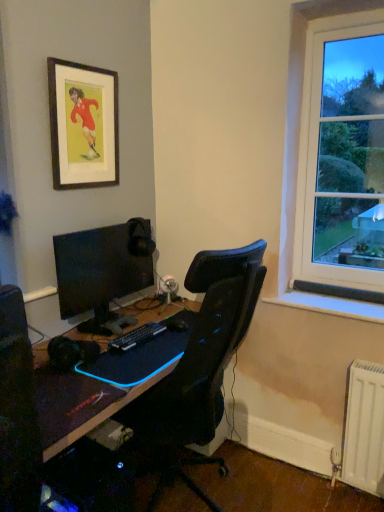
Locate an element on the screen. black plastic keyboard at center is located at coordinates (137, 336).

This screenshot has width=384, height=512. Describe the element at coordinates (168, 287) in the screenshot. I see `metallic silver speaker at center` at that location.

Describe the element at coordinates (79, 404) in the screenshot. I see `black matte desk at center` at that location.

Where is `black plastic keyboard at center`? The image size is (384, 512). black plastic keyboard at center is located at coordinates (137, 336).

Is wooden framed print at upper left bigger than black plastic keyboard at center?

Indeed, wooden framed print at upper left has a larger size compared to black plastic keyboard at center.

Is wooden framed print at upper left looking in the opposite direction of black plastic keyboard at center?

No, black plastic keyboard at center is not at the back of wooden framed print at upper left.

Measure the distance between wooden framed print at upper left and black plastic keyboard at center.

wooden framed print at upper left and black plastic keyboard at center are 36.84 inches apart from each other.

Looking at this image, is wooden framed print at upper left positioned far away from black plastic keyboard at center?

That's not correct — wooden framed print at upper left is a little close to black plastic keyboard at center.

Looking at this image, looking at their sizes, would you say black matte desk at center is wider or thinner than black glossy monitor at left?

Clearly, black matte desk at center has more width compared to black glossy monitor at left.

Which of these two, black matte desk at center or black glossy monitor at left, stands taller?

Standing taller between the two is black glossy monitor at left.

Is black matte desk at center bigger than black glossy monitor at left?

Yes.

Between black matte desk at center and black glossy monitor at left, which one is positioned behind?

Positioned behind is black glossy monitor at left.

How many degrees apart are the facing directions of metallic silver speaker at center and black glossy monitor at left?

They differ by 0.00374 degrees in their facing directions.

In the scene shown: From the image's perspective, would you say metallic silver speaker at center is shown under black glossy monitor at left?

Indeed, from the image's perspective, metallic silver speaker at center is shown beneath black glossy monitor at left.

Is black glossy monitor at left completely or partially inside metallic silver speaker at center?

No, metallic silver speaker at center does not contain black glossy monitor at left.

Which object is positioned more to the right, metallic silver speaker at center or black glossy monitor at left?

metallic silver speaker at center.

You are a GUI agent. You are given a task and a screenshot of the screen. Output one action in this format:
    pyautogui.click(x=<x>, y=<y>)
    Task: Click on the computer keyboard lying on the right of black matte desk at center
    The height and width of the screenshot is (512, 384).
    Given the screenshot: What is the action you would take?
    pyautogui.click(x=137, y=336)

Is black matte desk at center oriented away from black plastic keyboard at center?

No, black matte desk at center is not facing away from black plastic keyboard at center.

From a real-world perspective, is black matte desk at center located beneath black plastic keyboard at center?

Yes, from a real-world perspective, black matte desk at center is below black plastic keyboard at center.

Is black plastic keyboard at center at the left side of wooden framed print at upper left?

In fact, black plastic keyboard at center is to the right of wooden framed print at upper left.

Is black plastic keyboard at center facing towards wooden framed print at upper left?

No.

Is black plastic keyboard at center smaller than metallic silver speaker at center?

Correct, black plastic keyboard at center occupies less space than metallic silver speaker at center.

Consider the image. Can you tell me how much black plastic keyboard at center and metallic silver speaker at center differ in facing direction?

The facing directions of black plastic keyboard at center and metallic silver speaker at center are 0.000776 degrees apart.

Is point (158, 332) closer to camera compared to point (173, 286)?

Yes.

Looking at this image, is black plastic keyboard at center far from black glossy monitor at left?

No, black plastic keyboard at center is not far away from black glossy monitor at left.

Locate an element on the screen. The image size is (384, 512). computer monitor that is above the black plastic keyboard at center (from a real-world perspective) is located at coordinates (102, 270).

Which of these two, black plastic keyboard at center or black glossy monitor at left, is thinner?

Thinner between the two is black plastic keyboard at center.

From the image's perspective, is black plastic keyboard at center located above black glossy monitor at left?

Actually, black plastic keyboard at center appears below black glossy monitor at left in the image.

This screenshot has height=512, width=384. Find the location of `computer keyboard located underneath the wooden framed print at upper left (from a real-world perspective)`. computer keyboard located underneath the wooden framed print at upper left (from a real-world perspective) is located at coordinates (137, 336).

What are the coordinates of `desk in front of the black glossy monitor at left` in the screenshot? It's located at (79, 404).

When comparing their distances from black matte desk at center, does wooden framed print at upper left or metallic silver speaker at center seem closer?

metallic silver speaker at center is positioned closer to the anchor black matte desk at center.

Considering their positions, is black glossy monitor at left positioned closer to metallic silver speaker at center than black matte desk at center?

Based on the image, black glossy monitor at left appears to be nearer to metallic silver speaker at center.

Based on their spatial positions, is black glossy monitor at left or metallic silver speaker at center closer to black plastic keyboard at center?

black glossy monitor at left is closer to black plastic keyboard at center.

From the image, which object appears to be farther from black matte desk at center, black plastic keyboard at center or metallic silver speaker at center?

metallic silver speaker at center.

From the image, which object appears to be nearer to black plastic keyboard at center, metallic silver speaker at center or black glossy monitor at left?

Among the two, black glossy monitor at left is located nearer to black plastic keyboard at center.

When comparing their distances from wooden framed print at upper left, does black plastic keyboard at center or black glossy monitor at left seem further?

Among the two, black plastic keyboard at center is located further to wooden framed print at upper left.

Estimate the real-world distances between objects in this image. Which object is closer to black matte desk at center, metallic silver speaker at center or wooden framed print at upper left?

metallic silver speaker at center is positioned closer to the anchor black matte desk at center.

Looking at this image, looking at the image, which one is located further to metallic silver speaker at center, black matte desk at center or black glossy monitor at left?

Among the two, black matte desk at center is located further to metallic silver speaker at center.

This screenshot has width=384, height=512. In order to click on computer keyboard between wooden framed print at upper left and black matte desk at center vertically in this screenshot , I will do `click(137, 336)`.

The image size is (384, 512). I want to click on computer keyboard between black matte desk at center and metallic silver speaker at center from front to back, so click(x=137, y=336).

Where is `computer monitor between black matte desk at center and metallic silver speaker at center along the z-axis`? computer monitor between black matte desk at center and metallic silver speaker at center along the z-axis is located at coordinates pos(102,270).

What are the coordinates of `speaker between wooden framed print at upper left and black matte desk at center in the vertical direction` in the screenshot? It's located at (168, 287).